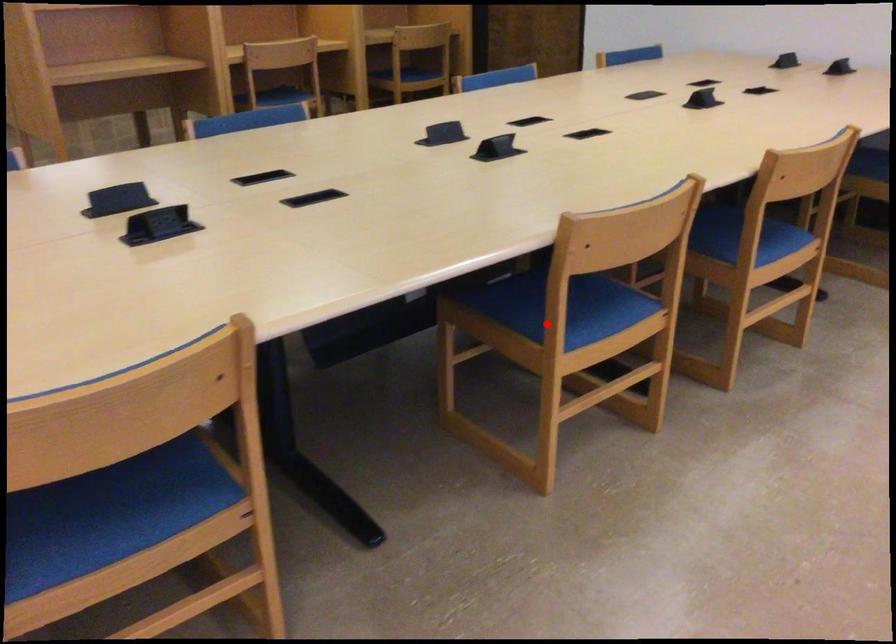
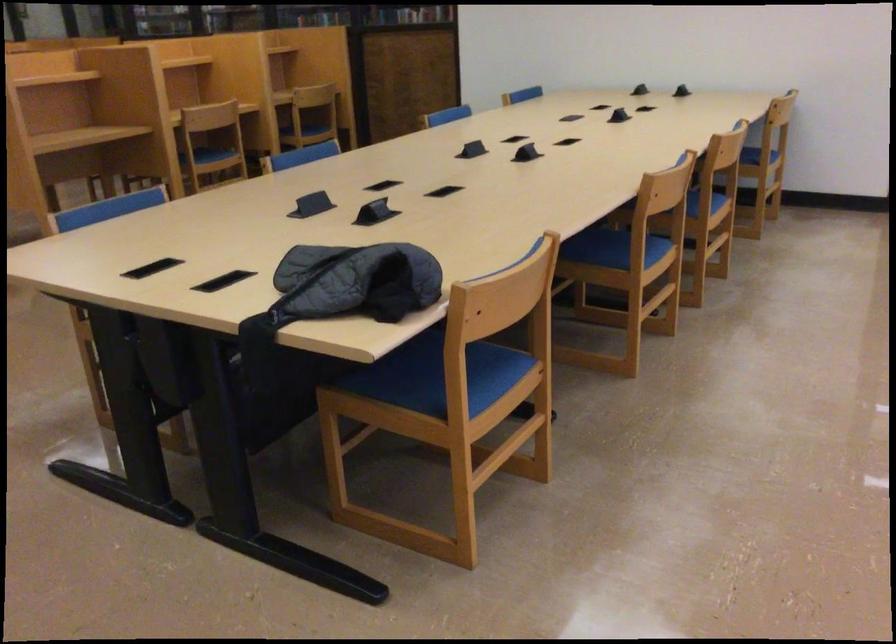
Locate, in the second image, the point that corresponds to the highlighted location in the first image.

(624, 254)